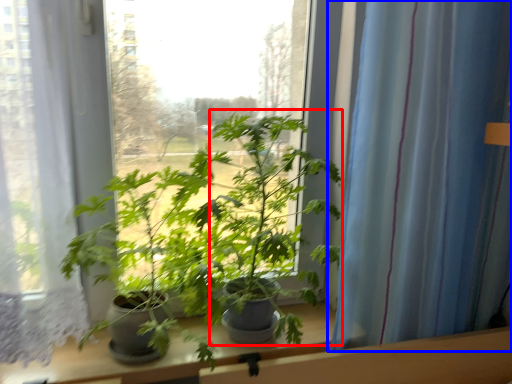
Question: Which object is further to the camera taking this photo, parsley (highlighted by a red box) or curtain (highlighted by a blue box)?

Choices:
 (A) parsley
 (B) curtain

Answer: (B)